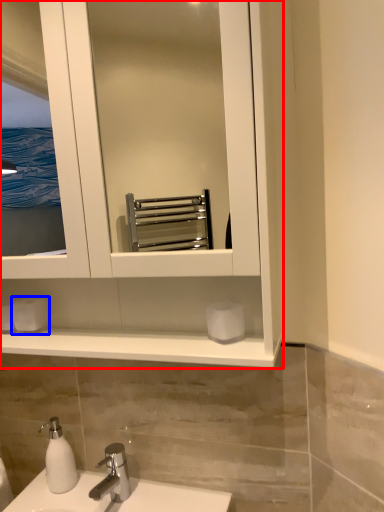
Question: Which point is closer to the camera, bathroom cabinet (highlighted by a red box) or toilet paper (highlighted by a blue box)?

Choices:
 (A) bathroom cabinet
 (B) toilet paper

Answer: (A)